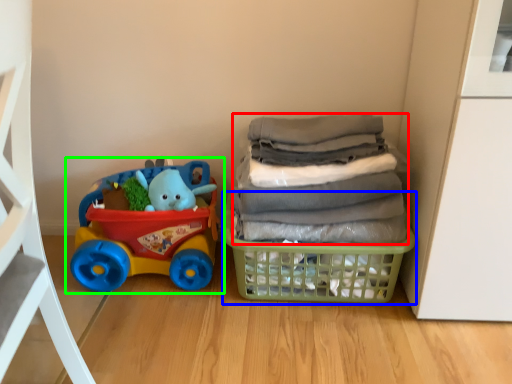
Question: Based on their relative distances, which object is farther from laundry (highlighted by a red box)? Choose from basket (highlighted by a blue box) and toy (highlighted by a green box).

Choices:
 (A) basket
 (B) toy

Answer: (B)